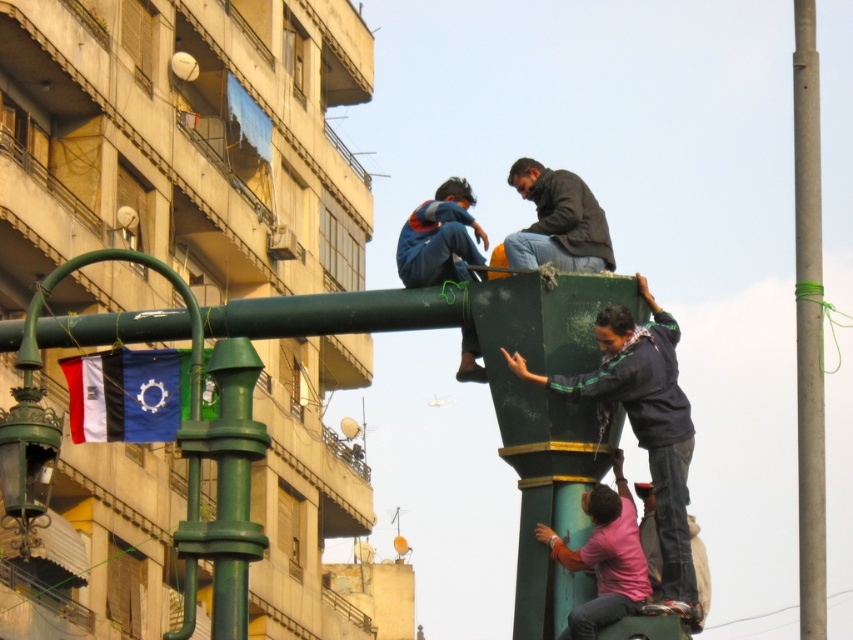
You are standing in an urban area and see a green streetlight pole with three people on it. You want to know the distance from your current position to the point marked as point (605, 400) on the pole. Can you estimate how far you are from that point?

The distance between point (605, 400) and the viewer is 146.71 feet, so you are approximately 146.71 feet away from that point.

You are a maintenance worker needing to inspect both the smooth green pole at right and the green painted metal pole at left. Based on their positions, which pole should you check first if you start from the left side of the image?

The green painted metal pole at left should be checked first since it is positioned to the left of the smooth green pole at right.

You are a window cleaner needing to reach the dark blue fabric at upper center located at point 0.666, 0.756. The pole has a classic design with a curved arm. Can you safely reach the fabric without climbing the pole?

The dark blue fabric at upper center is positioned at coordinates [643,426] on the pole. Since the pole has a curved arm, it might be possible to reach the fabric using a ladder or extendable tool without needing to climb the pole itself. However, safety depends on the specific height and accessibility of the area.